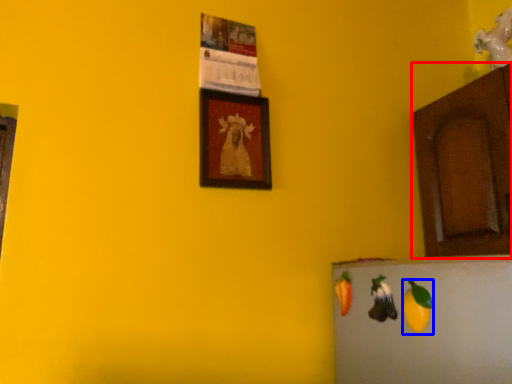
Question: Which object is closer to the camera taking this photo, cabinetry (highlighted by a red box) or fruit (highlighted by a blue box)?

Choices:
 (A) cabinetry
 (B) fruit

Answer: (B)